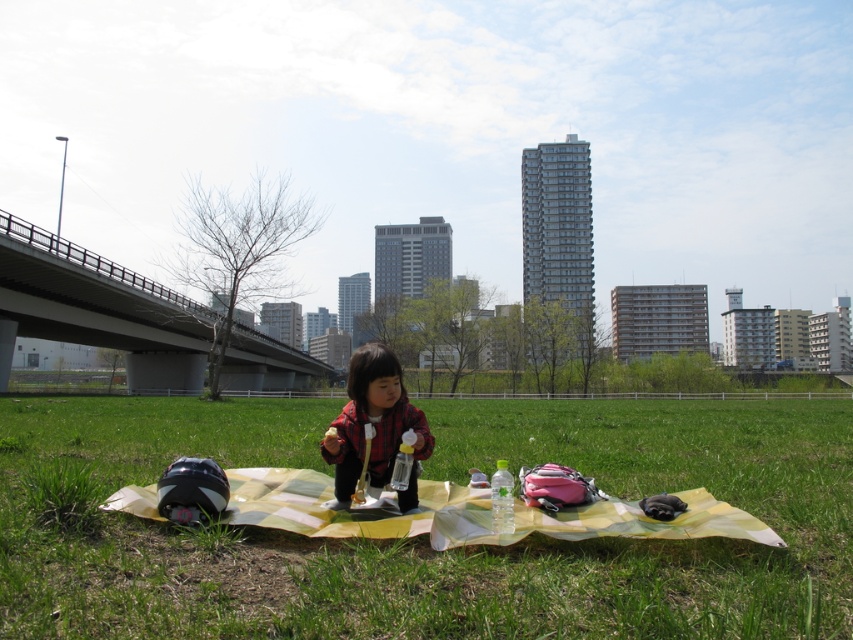
In the scene shown: Does green grass at center have a lesser width compared to matte red shirt at center?

No, green grass at center is not thinner than matte red shirt at center.

Image resolution: width=853 pixels, height=640 pixels. I want to click on green grass at center, so click(x=427, y=534).

Find the location of a particular element. The height and width of the screenshot is (640, 853). green grass at center is located at coordinates (427, 534).